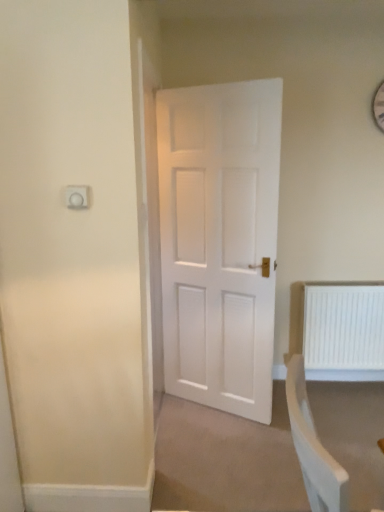
Find the location of `white plastic socket at upper left`. white plastic socket at upper left is located at coordinates (76, 197).

Measure the distance between white plastic socket at upper left and camera.

5.34 feet.

What do you see at coordinates (76, 197) in the screenshot? This screenshot has height=512, width=384. I see `white plastic socket at upper left` at bounding box center [76, 197].

What is the approximate width of white plastic radiator at lower right?

white plastic radiator at lower right is 5.43 inches wide.

This screenshot has width=384, height=512. Describe the element at coordinates (344, 331) in the screenshot. I see `white plastic radiator at lower right` at that location.

Where is `white plastic radiator at lower right`? This screenshot has width=384, height=512. white plastic radiator at lower right is located at coordinates (344, 331).

Where is `white plastic socket at upper left`? This screenshot has height=512, width=384. white plastic socket at upper left is located at coordinates (76, 197).

Which is more to the right, white plastic socket at upper left or white plastic radiator at lower right?

From the viewer's perspective, white plastic radiator at lower right appears more on the right side.

Is white plastic socket at upper left in front of or behind white plastic radiator at lower right in the image?

Clearly, white plastic socket at upper left is in front of white plastic radiator at lower right.

Which is closer to the camera, (68, 187) or (346, 318)?

The point (68, 187) is more forward.

From the image's perspective, does white plastic socket at upper left appear higher than white plastic radiator at lower right?

Yes, from the image's perspective, white plastic socket at upper left is on top of white plastic radiator at lower right.

From a real-world perspective, relative to white plastic radiator at lower right, is white plastic socket at upper left vertically above or below?

From a real-world perspective, white plastic socket at upper left is physically above white plastic radiator at lower right.

Between white plastic socket at upper left and white plastic radiator at lower right, which one has larger width?

Wider between the two is white plastic radiator at lower right.

In terms of height, does white plastic socket at upper left look taller or shorter compared to white plastic radiator at lower right?

In the image, white plastic socket at upper left appears to be shorter than white plastic radiator at lower right.

Between white plastic socket at upper left and white plastic radiator at lower right, which one has smaller size?

white plastic socket at upper left.

Is white plastic socket at upper left not inside white plastic radiator at lower right?

Yes, white plastic socket at upper left is outside of white plastic radiator at lower right.

Would you consider white plastic socket at upper left to be distant from white plastic radiator at lower right?

Indeed, white plastic socket at upper left is not near white plastic radiator at lower right.

Is white plastic radiator at lower right at the back of white plastic socket at upper left?

white plastic socket at upper left is not turned away from white plastic radiator at lower right.

Image resolution: width=384 pixels, height=512 pixels. I want to click on radiator that is behind the white plastic socket at upper left, so click(344, 331).

Between white plastic radiator at lower right and white plastic socket at upper left, which one appears on the left side from the viewer's perspective?

Positioned to the left is white plastic socket at upper left.

In the image, is white plastic radiator at lower right positioned in front of or behind white plastic socket at upper left?

Clearly, white plastic radiator at lower right is behind white plastic socket at upper left.

Considering the points (347, 344) and (74, 198), which point is behind, point (347, 344) or point (74, 198)?

Point (347, 344)

From the image's perspective, is white plastic radiator at lower right under white plastic socket at upper left?

Yes.

From a real-world perspective, does white plastic radiator at lower right stand above white plastic socket at upper left?

No, from a real-world perspective, white plastic radiator at lower right is not over white plastic socket at upper left

Is white plastic radiator at lower right thinner than white plastic socket at upper left?

Incorrect, the width of white plastic radiator at lower right is not less than that of white plastic socket at upper left.

Considering the sizes of white plastic radiator at lower right and white plastic socket at upper left in the image, is white plastic radiator at lower right taller or shorter than white plastic socket at upper left?

Considering their sizes, white plastic radiator at lower right has more height than white plastic socket at upper left.

In terms of size, does white plastic radiator at lower right appear bigger or smaller than white plastic socket at upper left?

In the image, white plastic radiator at lower right appears to be larger than white plastic socket at upper left.

Would you say white plastic radiator at lower right contains white plastic socket at upper left?

No, white plastic socket at upper left is not inside white plastic radiator at lower right.

Is white plastic radiator at lower right far away from white plastic socket at upper left?

white plastic radiator at lower right is far away from white plastic socket at upper left.

Does white plastic radiator at lower right turn towards white plastic socket at upper left?

No, white plastic radiator at lower right does not turn towards white plastic socket at upper left.

How distant is white plastic radiator at lower right from white plastic socket at upper left?

6.71 feet.

Identify the location of electric outlet positioned vertically above the white plastic radiator at lower right (from a real-world perspective). The width and height of the screenshot is (384, 512). (76, 197).

Locate an element on the screen. The image size is (384, 512). electric outlet above the white plastic radiator at lower right (from a real-world perspective) is located at coordinates (76, 197).

In order to click on electric outlet located on the left of white plastic radiator at lower right in this screenshot , I will do `click(76, 197)`.